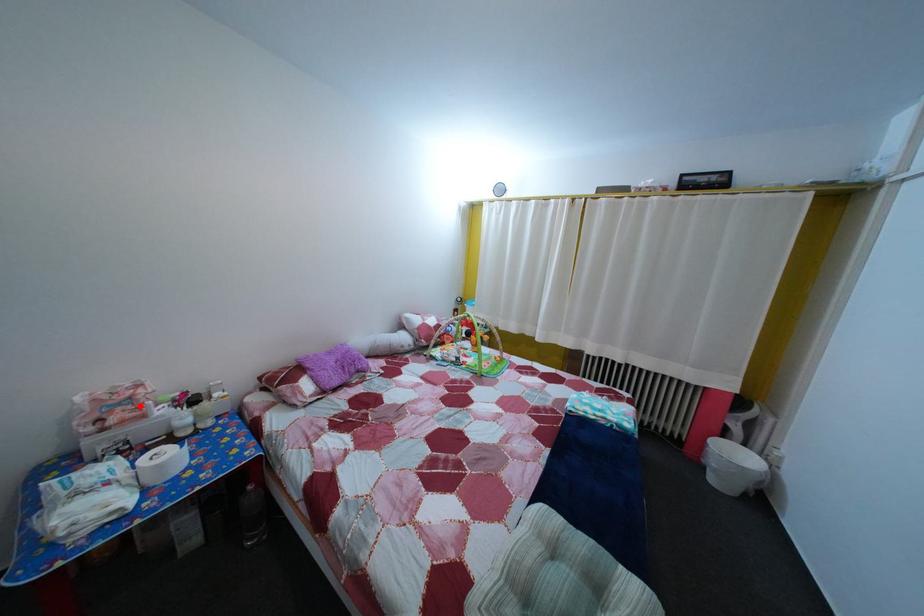
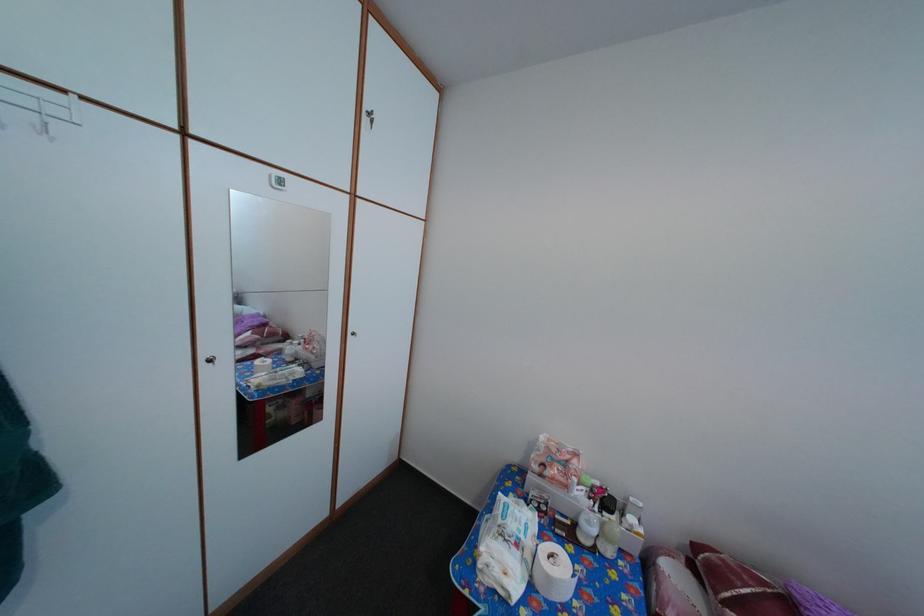
Question: I am providing you with two images of the same scene from different viewpoints. Image1 has a red point marked. In image2, the corresponding 3D location appears at what relative position? Reply with the corresponding letter.

Choices:
 (A) Closer
 (B) Farther

Answer: (B)